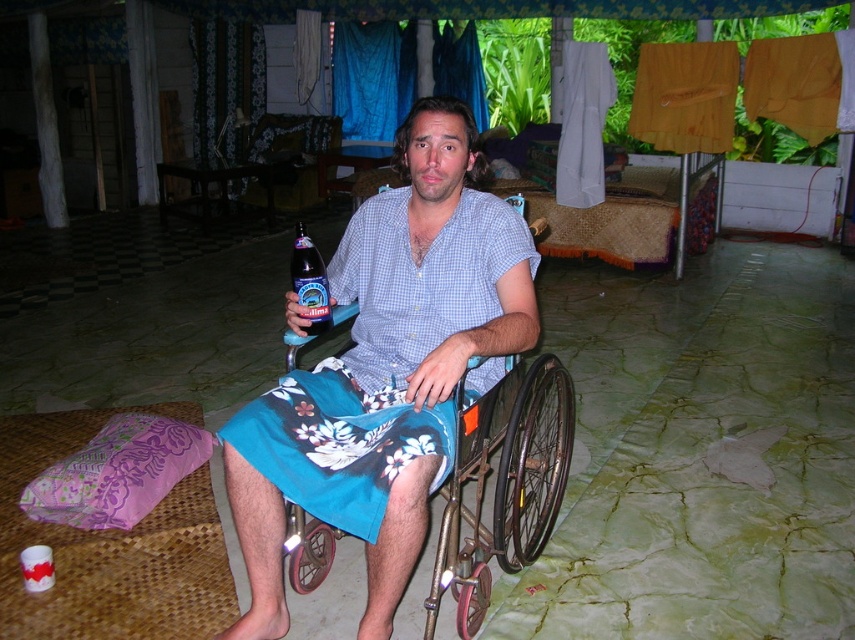
Question: Considering the real-world distances, which object is farthest from the blue checkered shirt at center?

Choices:
 (A) dark blue glass bottle at center
 (B) metallic silver wheelchair at center

Answer: (B)

Question: Which point is closer to the camera?

Choices:
 (A) dark blue glass bottle at center
 (B) blue checkered shirt at center

Answer: (B)

Question: Which point is closer to the camera?

Choices:
 (A) 494,410
 (B) 470,308
 (C) 464,340

Answer: (C)

Question: From the image, what is the correct spatial relationship of blue floral shorts at center in relation to dark blue glass bottle at center?

Choices:
 (A) left
 (B) right

Answer: (B)

Question: Can you confirm if blue checkered shirt at center is positioned below dark blue glass bottle at center?

Choices:
 (A) yes
 (B) no

Answer: (A)

Question: Can you confirm if blue checkered shirt at center is positioned below dark blue glass bottle at center?

Choices:
 (A) yes
 (B) no

Answer: (A)